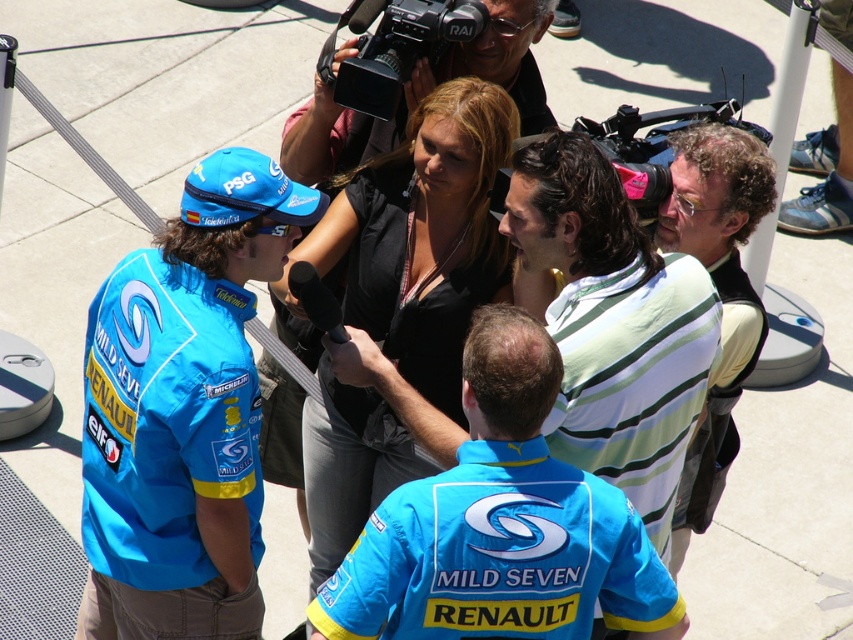
Can you confirm if blue jersey at center is positioned above black plastic video camera at upper center?

No.

Identify the location of blue jersey at center. pyautogui.click(x=502, y=525).

Locate an element on the screen. blue jersey at center is located at coordinates [502, 525].

Does matte blue jersey at left have a lesser height compared to matte black camera at upper right?

Yes, matte blue jersey at left is shorter than matte black camera at upper right.

Which of these two, matte blue jersey at left or matte black camera at upper right, stands shorter?

matte blue jersey at left

Which is behind, point (120, 442) or point (752, 214)?

The point (752, 214) is more distant.

Locate an element on the screen. This screenshot has height=640, width=853. matte blue jersey at left is located at coordinates (183, 412).

Does matte blue jersey at left have a larger size compared to matte black camera at center?

Yes, matte blue jersey at left is bigger than matte black camera at center.

Does matte blue jersey at left have a greater height compared to matte black camera at center?

Yes, matte blue jersey at left is taller than matte black camera at center.

Is point (308, 209) positioned before point (540, 116)?

That is True.

Locate an element on the screen. The image size is (853, 640). matte blue jersey at left is located at coordinates (183, 412).